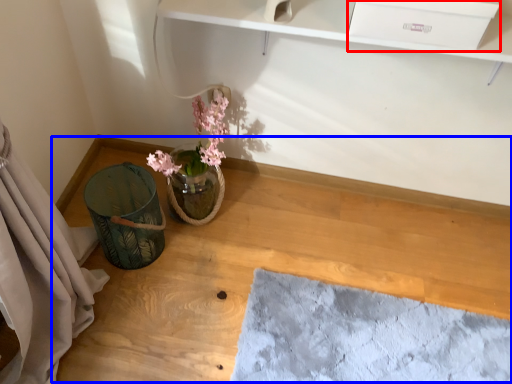
Question: Which object is closer to the camera taking this photo, drawer (highlighted by a red box) or table (highlighted by a blue box)?

Choices:
 (A) drawer
 (B) table

Answer: (A)